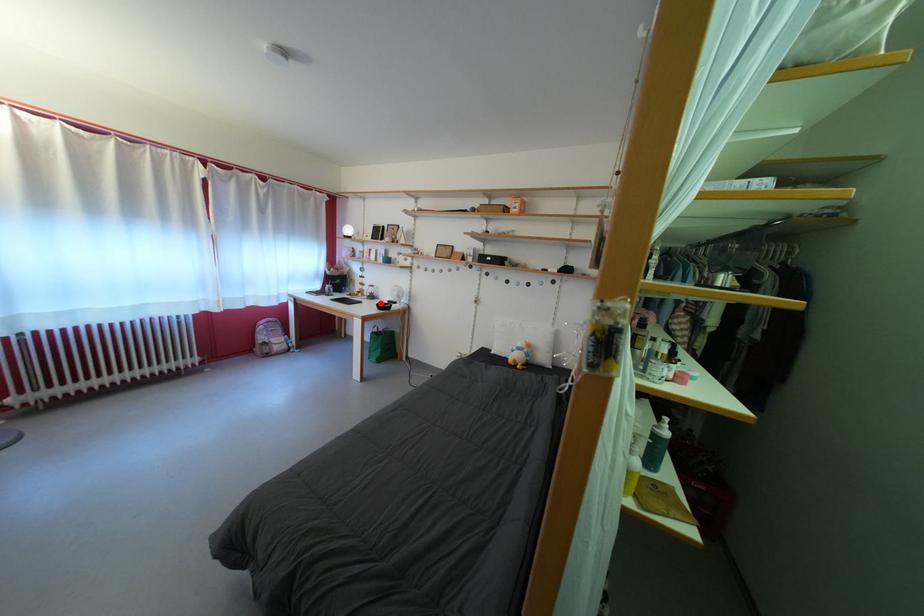
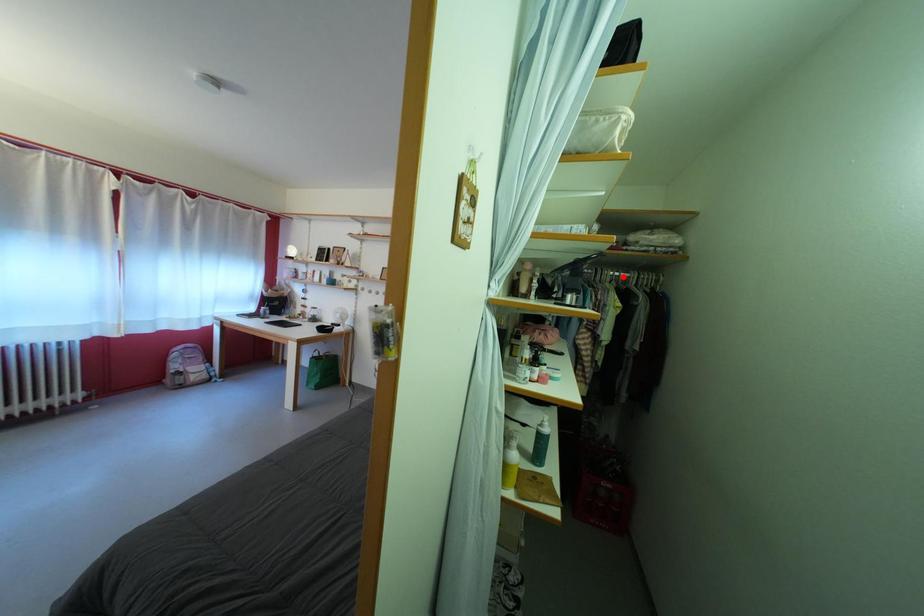
I am providing you with two images of the same scene from different viewpoints. A red point is marked on the first image and another point is marked on the second image. Is the marked point in image1 the same physical position as the marked point in image2?

No